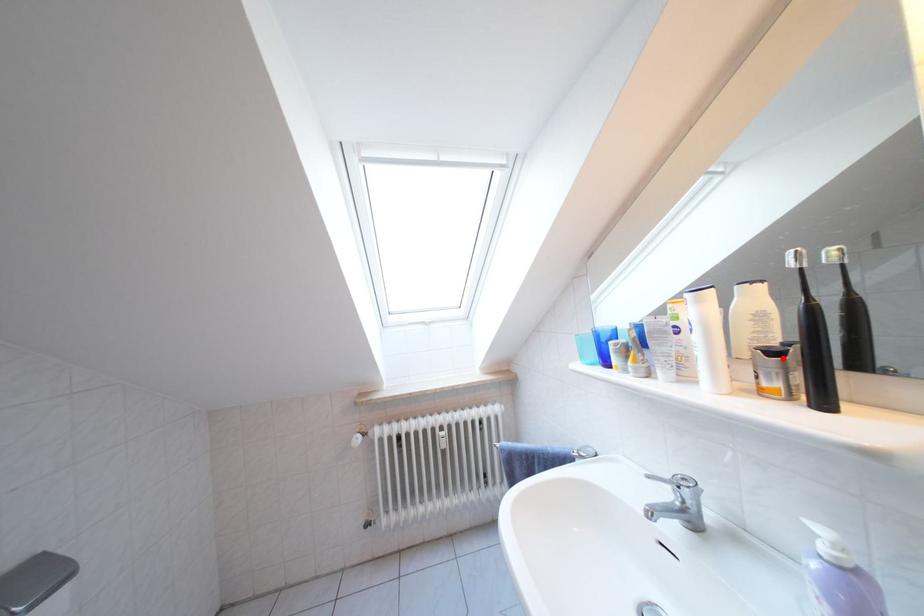
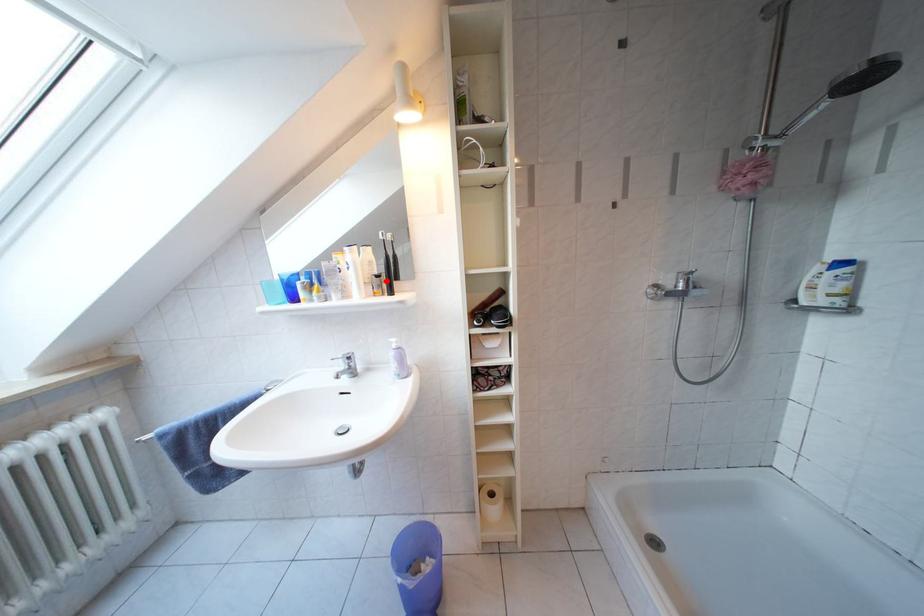
I am providing you with two images of the same scene from different viewpoints. A red point is marked on the first image and another point is marked on the second image. Does the point marked in image1 correspond to the same location as the one in image2?

Yes